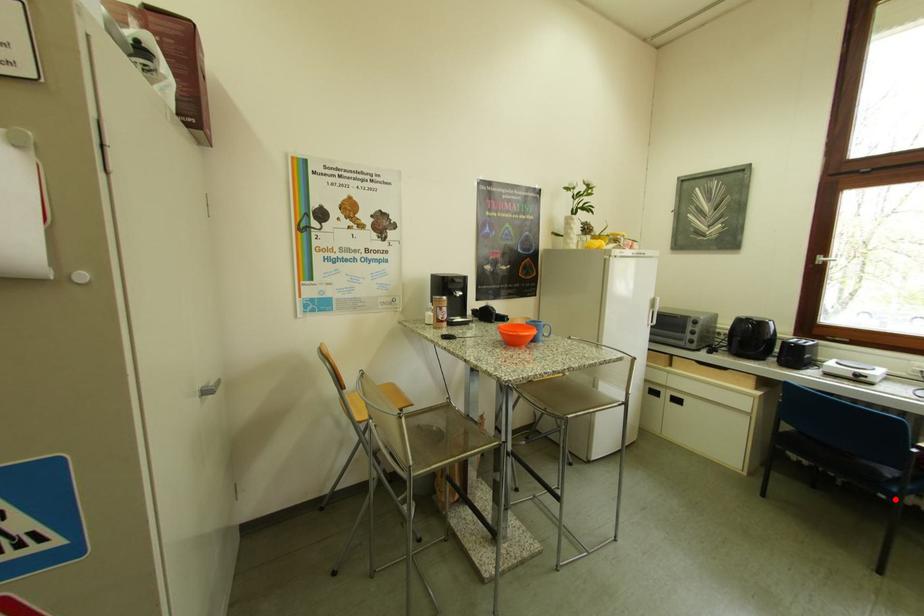
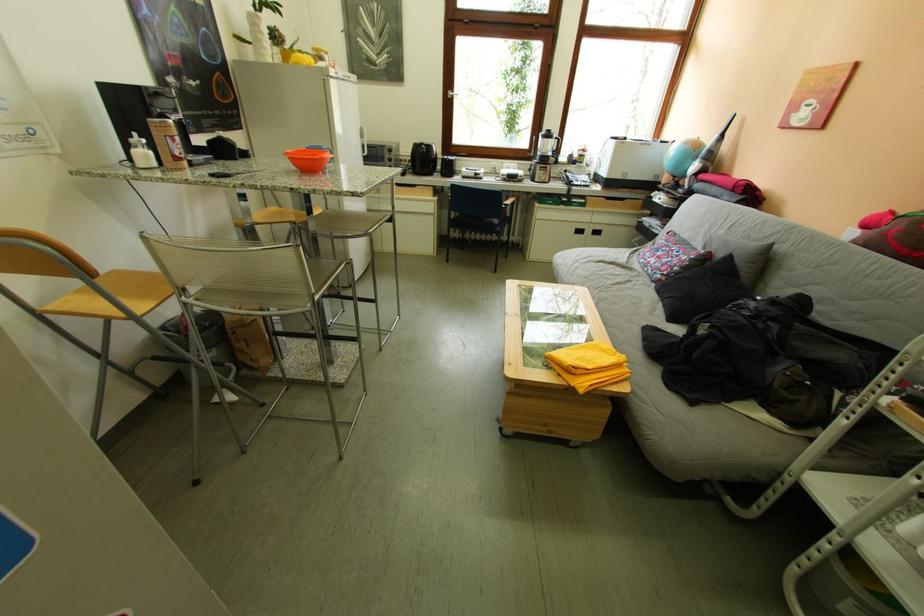
Question: I am providing you with two images of the same scene from different viewpoints. Given a red point in image1, look at the same physical point in image2. Is it:

Choices:
 (A) Closer to the viewpoint
 (B) Farther from the viewpoint

Answer: (A)